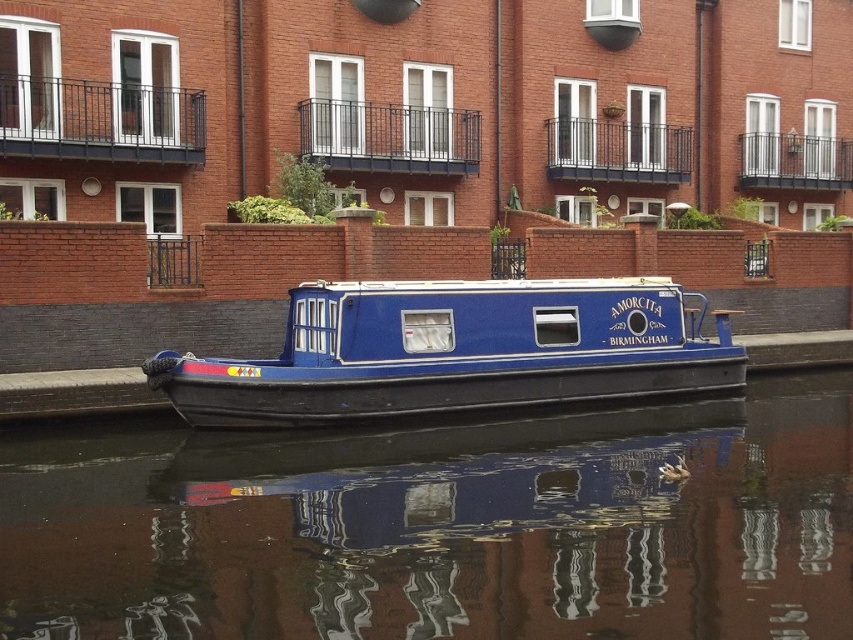
You are standing on the dock looking at the canal. You see the glossy blue water at center and the blue polished wood barge at center. Which object is positioned to the left of the other?

The glossy blue water at center is to the left of blue polished wood barge at center.

You are standing on the dock next to the canal and want to know if the glossy blue water at center is wider than the blue polished wood barge at center. Can you confirm this?

The glossy blue water at center is wider than the blue polished wood barge at center, so yes, the water is wider than the barge.